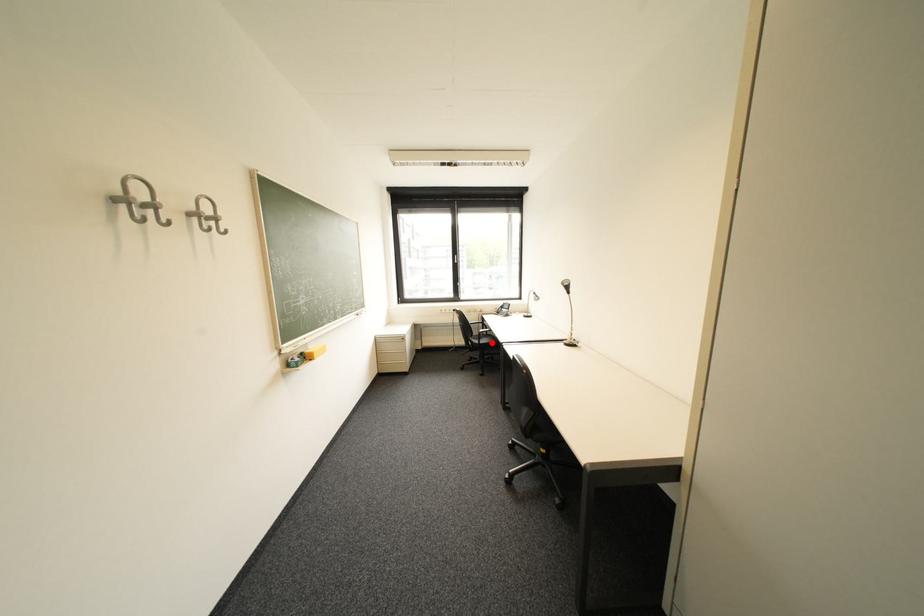
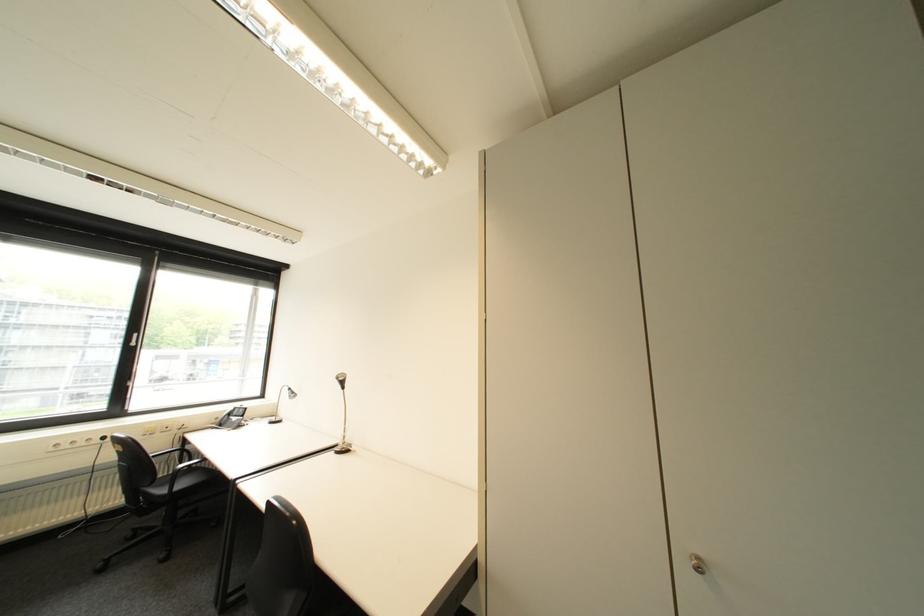
In the second image, find the point that corresponds to the highlighted location in the first image.

(187, 488)